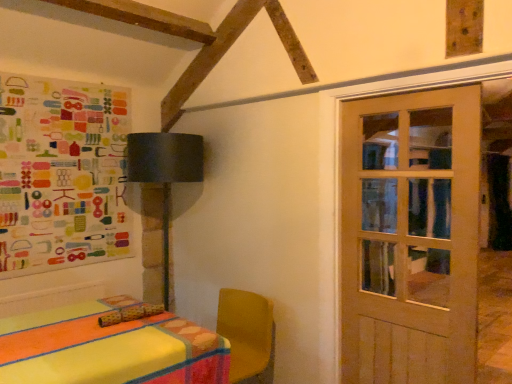
Question: In terms of width, does matte black lampshade at upper left look wider or thinner when compared to colorful paper collage at upper left?

Choices:
 (A) thin
 (B) wide

Answer: (B)

Question: Looking at the image, does matte black lampshade at upper left seem bigger or smaller compared to colorful paper collage at upper left?

Choices:
 (A) big
 (B) small

Answer: (A)

Question: Which object is positioned closest to the wooden door at right?

Choices:
 (A) matte black lampshade at upper left
 (B) colorful paper collage at upper left

Answer: (A)

Question: Which of these objects is positioned farthest from the matte black lampshade at upper left?

Choices:
 (A) wooden door at right
 (B) colorful paper collage at upper left

Answer: (A)